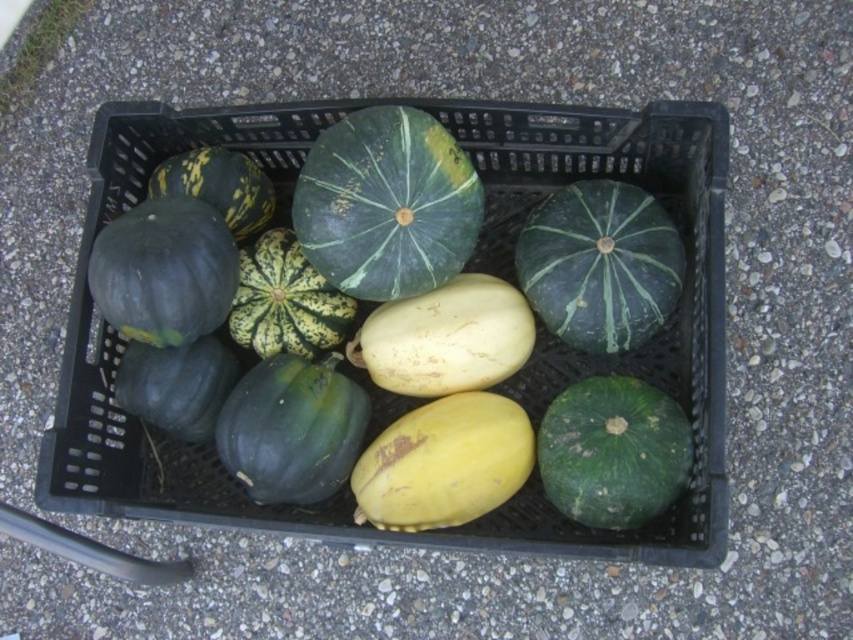
Consider the image. Between black plastic basket at center and green matte squash at center, which one has more height?

black plastic basket at center is taller.

Where is `black plastic basket at center`? The image size is (853, 640). black plastic basket at center is located at coordinates (x=467, y=268).

Which is in front, point (184, 131) or point (428, 115)?

Point (428, 115)

Find the location of a particular element. This screenshot has height=640, width=853. black plastic basket at center is located at coordinates (467, 268).